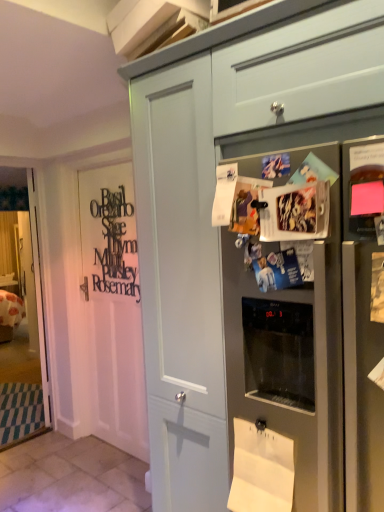
This screenshot has width=384, height=512. I want to click on vacant area in front of clear glass door at left, so click(x=18, y=455).